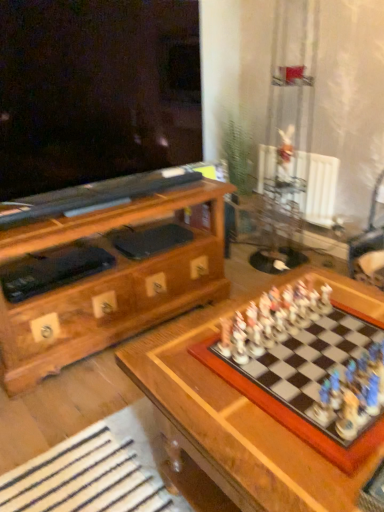
Question: Is metallic silver swivel chair at right turned away from wooden chessboard at center?

Choices:
 (A) yes
 (B) no

Answer: (B)

Question: Could you tell me if metallic silver swivel chair at right is facing wooden chessboard at center?

Choices:
 (A) no
 (B) yes

Answer: (A)

Question: Is metallic silver swivel chair at right wider than wooden chessboard at center?

Choices:
 (A) yes
 (B) no

Answer: (B)

Question: Considering the relative sizes of metallic silver swivel chair at right and wooden chessboard at center in the image provided, is metallic silver swivel chair at right smaller than wooden chessboard at center?

Choices:
 (A) yes
 (B) no

Answer: (A)

Question: Can we say metallic silver swivel chair at right lies outside wooden chessboard at center?

Choices:
 (A) no
 (B) yes

Answer: (B)

Question: From a real-world perspective, relative to wooden chessboard at center, is metallic silver swivel chair at right vertically above or below?

Choices:
 (A) below
 (B) above

Answer: (B)

Question: Is metallic silver swivel chair at right in front of or behind wooden chessboard at center in the image?

Choices:
 (A) behind
 (B) front

Answer: (A)

Question: Which is correct: metallic silver swivel chair at right is inside wooden chessboard at center, or outside of it?

Choices:
 (A) inside
 (B) outside

Answer: (B)

Question: Looking at their shapes, would you say metallic silver swivel chair at right is wider or thinner than wooden chessboard at center?

Choices:
 (A) wide
 (B) thin

Answer: (B)

Question: Considering the positions of metallic silver swivel chair at right and white plastic radiator at upper right in the image, is metallic silver swivel chair at right taller or shorter than white plastic radiator at upper right?

Choices:
 (A) short
 (B) tall

Answer: (B)

Question: Is point (355, 244) closer or farther from the camera than point (317, 168)?

Choices:
 (A) farther
 (B) closer

Answer: (B)

Question: In terms of width, does metallic silver swivel chair at right look wider or thinner when compared to white plastic radiator at upper right?

Choices:
 (A) thin
 (B) wide

Answer: (B)

Question: From the image's perspective, is metallic silver swivel chair at right located above or below white plastic radiator at upper right?

Choices:
 (A) below
 (B) above

Answer: (A)

Question: From the image's perspective, relative to metallic silver swivel chair at right, is wooden chessboard at center above or below?

Choices:
 (A) above
 (B) below

Answer: (B)

Question: Would you say wooden chessboard at center is to the left or to the right of metallic silver swivel chair at right in the picture?

Choices:
 (A) left
 (B) right

Answer: (A)